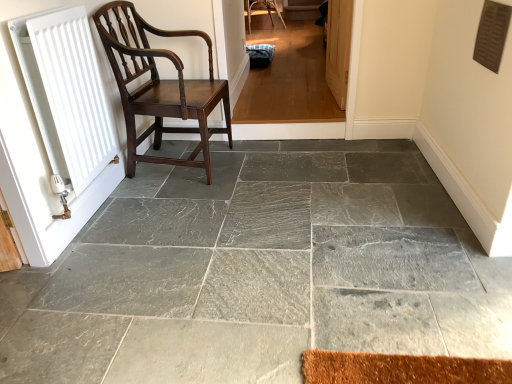
Find the location of a particular element. The image size is (512, 384). vacant area that is in front of dark wood chair at left is located at coordinates (200, 206).